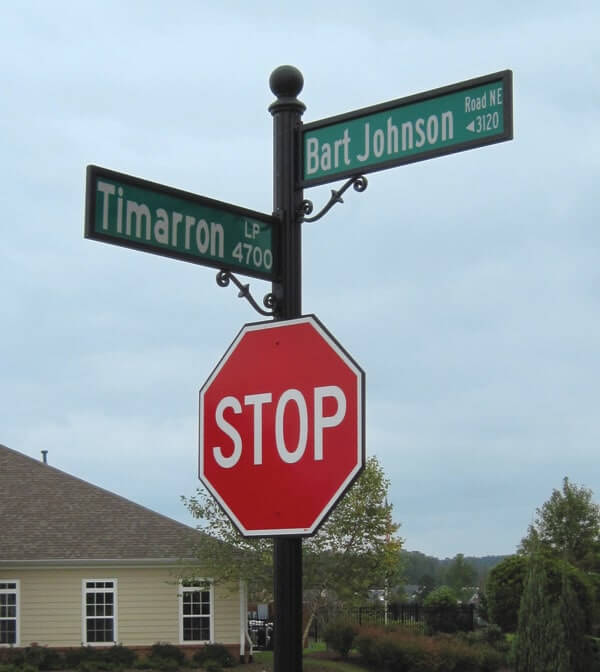
You are a GUI agent. You are given a task and a screenshot of the screen. Output one action in this format:
    pyautogui.click(x=<x>, y=<y>)
    Task: Click on the windows
    
    Given the screenshot: What is the action you would take?
    pyautogui.click(x=7, y=628), pyautogui.click(x=5, y=607), pyautogui.click(x=1, y=583), pyautogui.click(x=97, y=582), pyautogui.click(x=101, y=601), pyautogui.click(x=100, y=628), pyautogui.click(x=199, y=624), pyautogui.click(x=197, y=605), pyautogui.click(x=193, y=586)